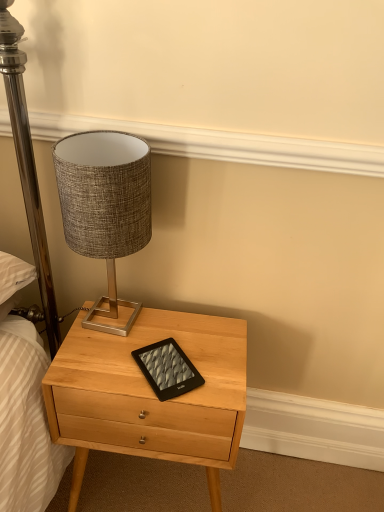
Question: From the image's perspective, is textured fabric lampshade at upper left located beneath light wood nightstand at center?

Choices:
 (A) no
 (B) yes

Answer: (A)

Question: Does textured fabric lampshade at upper left have a smaller size compared to light wood nightstand at center?

Choices:
 (A) no
 (B) yes

Answer: (B)

Question: Is textured fabric lampshade at upper left taller than light wood nightstand at center?

Choices:
 (A) no
 (B) yes

Answer: (A)

Question: Does textured fabric lampshade at upper left have a larger size compared to light wood nightstand at center?

Choices:
 (A) yes
 (B) no

Answer: (B)

Question: Can you confirm if textured fabric lampshade at upper left is positioned to the right of light wood nightstand at center?

Choices:
 (A) no
 (B) yes

Answer: (A)

Question: Is textured fabric lampshade at upper left thinner than light wood nightstand at center?

Choices:
 (A) no
 (B) yes

Answer: (B)

Question: Is black matte tablet at center surrounding textured fabric lampshade at upper left?

Choices:
 (A) yes
 (B) no

Answer: (B)

Question: Is black matte tablet at center closer to camera compared to textured fabric lampshade at upper left?

Choices:
 (A) no
 (B) yes

Answer: (A)

Question: Is black matte tablet at center thinner than textured fabric lampshade at upper left?

Choices:
 (A) yes
 (B) no

Answer: (A)

Question: From the image's perspective, is black matte tablet at center below textured fabric lampshade at upper left?

Choices:
 (A) no
 (B) yes

Answer: (B)

Question: Does black matte tablet at center have a greater height compared to textured fabric lampshade at upper left?

Choices:
 (A) no
 (B) yes

Answer: (A)

Question: Does black matte tablet at center turn towards textured fabric lampshade at upper left?

Choices:
 (A) yes
 (B) no

Answer: (B)

Question: Would you say light wood nightstand at center is outside black matte tablet at center?

Choices:
 (A) yes
 (B) no

Answer: (A)